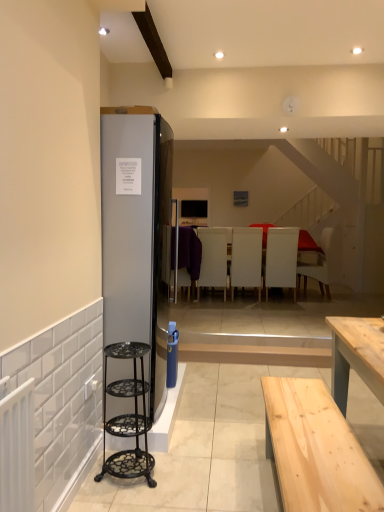
The image size is (384, 512). In order to click on free space in front of black wrought iron step stool at left in this screenshot , I will do `click(132, 497)`.